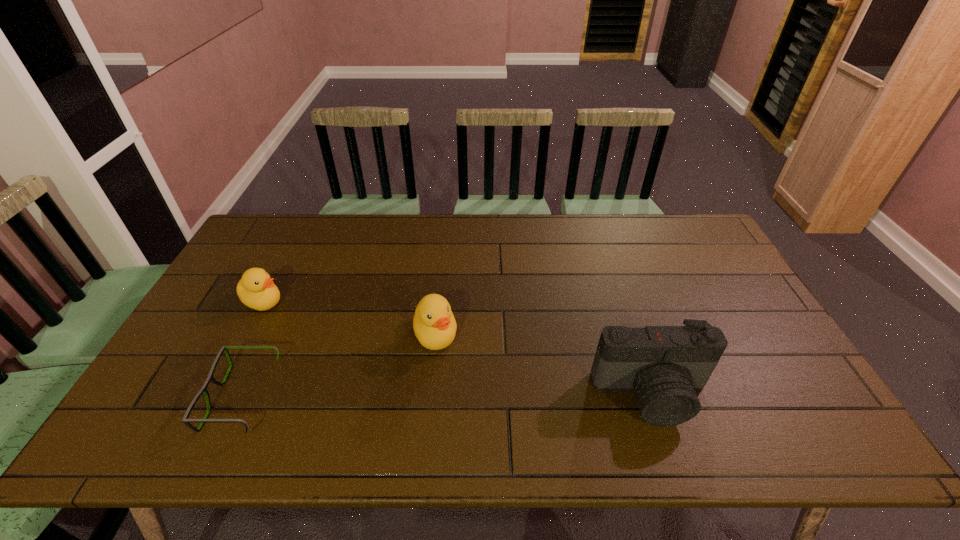
In the image, there is a desktop. Identify the location of vacant space at the far left corner. This screenshot has height=540, width=960. (282, 228).

The width and height of the screenshot is (960, 540). Identify the location of free space at the far right corner. (672, 229).

Where is `free point at the near right corner`? free point at the near right corner is located at coordinates (811, 401).

You are a GUI agent. You are given a task and a screenshot of the screen. Output one action in this format:
    pyautogui.click(x=<x>, y=<y>)
    Task: Click on the vacant space that's between the third object from left to right and the camera
    
    Given the screenshot: What is the action you would take?
    pyautogui.click(x=543, y=364)

The width and height of the screenshot is (960, 540). Find the location of `vacant point located between the second shortest object and the second object from right to left`. vacant point located between the second shortest object and the second object from right to left is located at coordinates (349, 317).

You are a GUI agent. You are given a task and a screenshot of the screen. Output one action in this format:
    pyautogui.click(x=<x>, y=<y>)
    Task: Click on the blank region between the second object from right to left and the spectacles
    This screenshot has width=960, height=540.
    Given the screenshot: What is the action you would take?
    pyautogui.click(x=339, y=366)

In order to click on free spot between the second object from right to left and the rightmost object in this screenshot , I will do `click(543, 364)`.

This screenshot has width=960, height=540. What are the coordinates of `blank region between the third tallest object and the second object from right to left` in the screenshot? It's located at (349, 317).

At what (x,y) coordinates should I click in order to perform the action: click on vacant area between the duckling and the tallest object. Please return your answer as a coordinate pair (x, y). Looking at the image, I should click on (457, 348).

At what (x,y) coordinates should I click in order to perform the action: click on unoccupied area between the duck and the shortest object. Please return your answer as a coordinate pair (x, y). Looking at the image, I should click on 339,366.